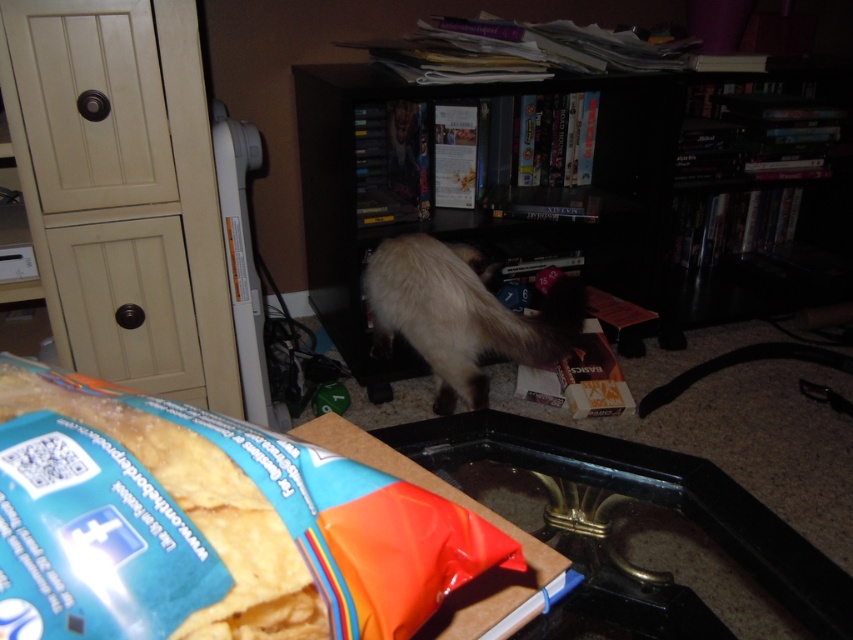
Question: Can you confirm if translucent plastic bag of chips at lower center is bigger than black matte bookcase at center?

Choices:
 (A) no
 (B) yes

Answer: (A)

Question: Is the position of translucent plastic bag of chips at lower center less distant than that of black matte bookcase at center?

Choices:
 (A) no
 (B) yes

Answer: (B)

Question: Which is farther from the translucent plastic bag of chips at lower center?

Choices:
 (A) fuzzy brown cat at center
 (B) black matte bookcase at center

Answer: (B)

Question: Which of the following is the farthest from the observer?

Choices:
 (A) (399, 292)
 (B) (143, 545)
 (C) (845, 131)

Answer: (C)

Question: Considering the real-world distances, which object is farthest from the black matte bookcase at center?

Choices:
 (A) fuzzy brown cat at center
 (B) translucent plastic bag of chips at lower center

Answer: (B)

Question: Does translucent plastic bag of chips at lower center appear over fuzzy brown cat at center?

Choices:
 (A) yes
 (B) no

Answer: (B)